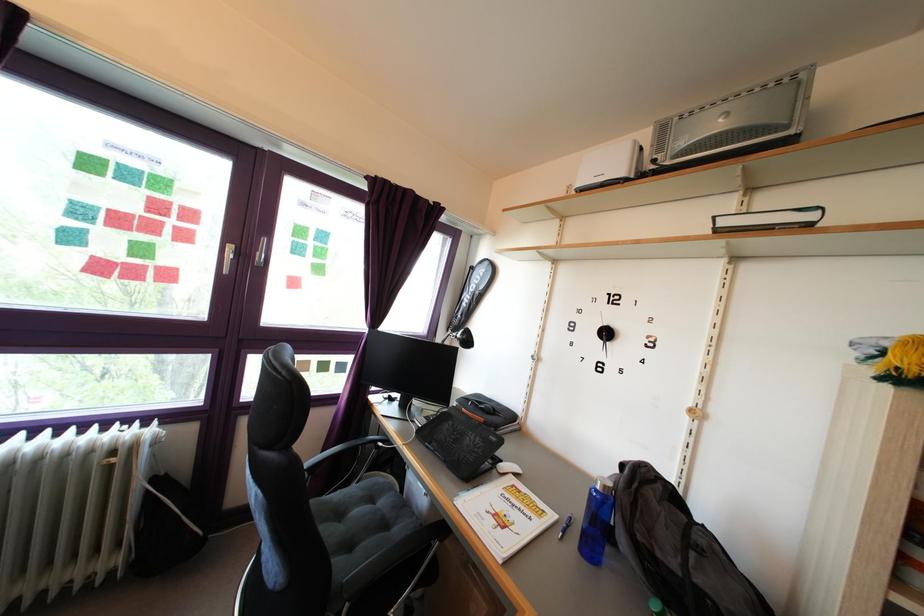
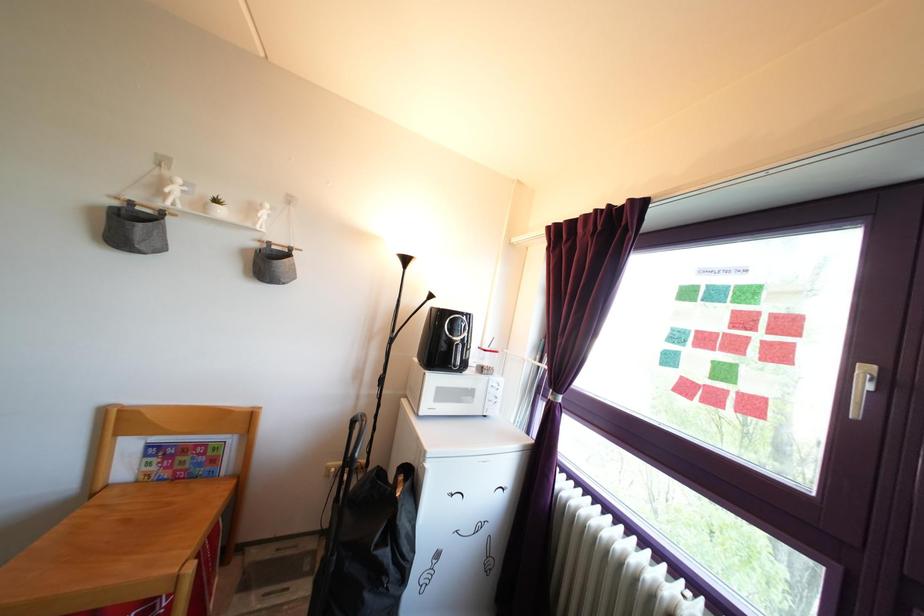
Question: The first image is from the beginning of the video and the second image is from the end. How did the camera likely rotate when shooting the video?

Choices:
 (A) Left
 (B) Right
 (C) Up
 (D) Down

Answer: (A)